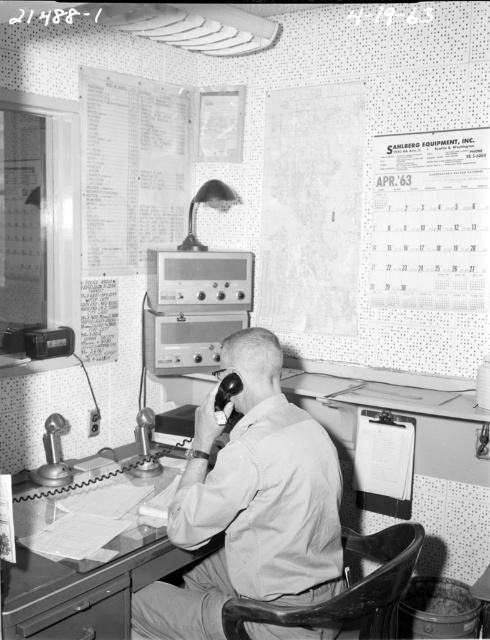
Question: Does paperboard sheet at upper left appear over leather-like chair at lower center?

Choices:
 (A) yes
 (B) no

Answer: (A)

Question: Can you confirm if leather-like chair at lower center is wider than matte glass lamp at upper center?

Choices:
 (A) no
 (B) yes

Answer: (B)

Question: Estimate the real-world distances between objects in this image. Which object is closer to the leather-like chair at lower center?

Choices:
 (A) matte glass lamp at upper center
 (B) paperboard sheet at upper left

Answer: (A)

Question: From the image, what is the correct spatial relationship of smooth wooden desk at center in relation to leather-like chair at lower center?

Choices:
 (A) right
 (B) left

Answer: (B)

Question: Considering the real-world distances, which object is closest to the smooth wooden desk at center?

Choices:
 (A) paperboard sheet at upper left
 (B) leather-like chair at lower center
 (C) matte glass lamp at upper center
 (D) light beige uniform at center

Answer: (D)

Question: Which object is the closest to the light beige uniform at center?

Choices:
 (A) matte glass lamp at upper center
 (B) leather-like chair at lower center

Answer: (B)